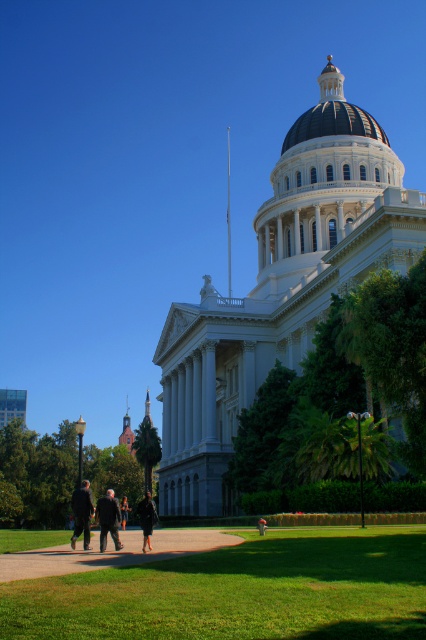
Is point (311, 540) positioned before point (147, 529)?

No, it is behind (147, 529).

Who is more forward, [14,616] or [146,522]?

Positioned in front is point [14,616].

You are a GUI agent. You are given a task and a screenshot of the screen. Output one action in this format:
    pyautogui.click(x=<x>, y=<y>)
    Task: Click on the green grass at lower center
    
    Given the screenshot: What is the action you would take?
    pyautogui.click(x=239, y=593)

In the scene shown: Is blue glossy dome at upper center above dark brown leather coat at center?

Yes.

Can you confirm if blue glossy dome at upper center is positioned to the left of dark brown leather coat at center?

No, blue glossy dome at upper center is not to the left of dark brown leather coat at center.

Where is `blue glossy dome at upper center`? The height and width of the screenshot is (640, 426). blue glossy dome at upper center is located at coordinates (333, 115).

Can you confirm if blue glossy dome at upper center is positioned above dark brown leather jacket at center?

Correct, blue glossy dome at upper center is located above dark brown leather jacket at center.

Between blue glossy dome at upper center and dark brown leather jacket at center, which one has more height?

With more height is blue glossy dome at upper center.

Which is in front, point (342, 131) or point (126, 497)?

Point (342, 131)

Where is `blue glossy dome at upper center`? blue glossy dome at upper center is located at coordinates (333, 115).